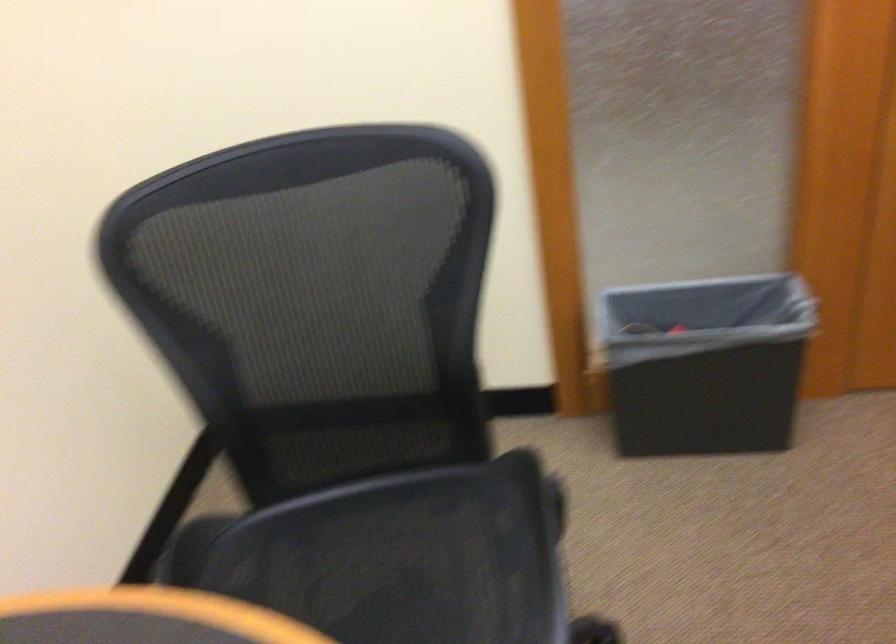
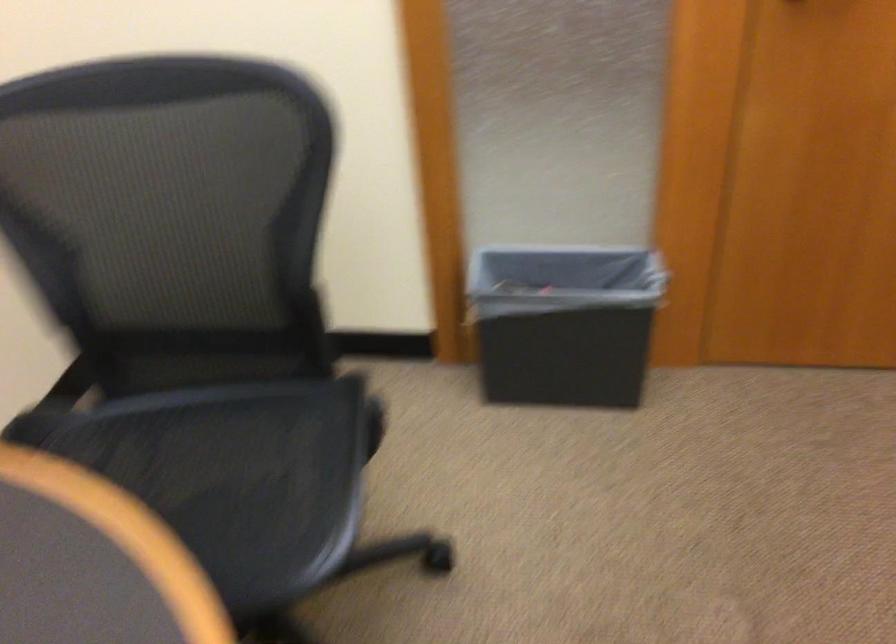
Question: Based on the continuous images, in which direction is the camera rotating? Reply with the corresponding letter.

Choices:
 (A) Left
 (B) Right
 (C) Up
 (D) Down

Answer: (B)